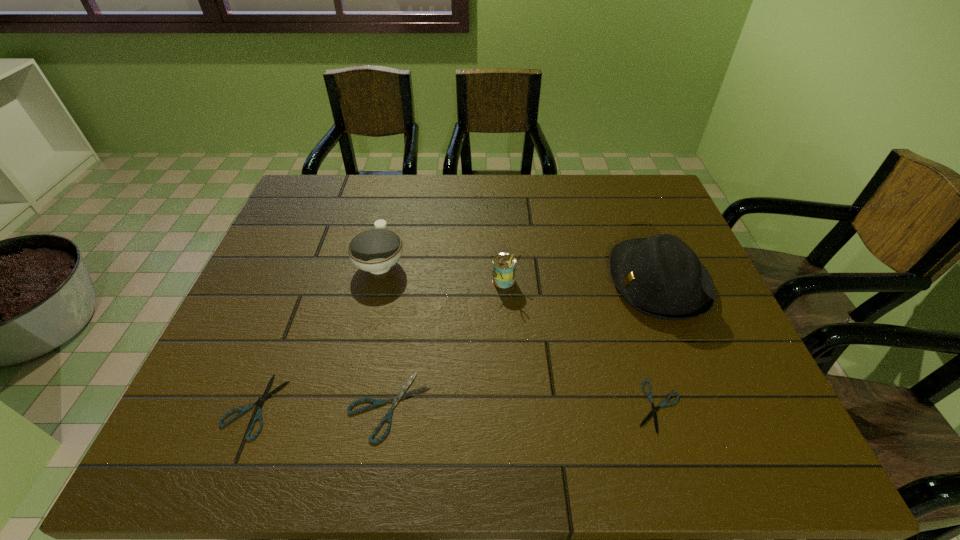
Where is `free space located on the back of the second shears from right to left`? This screenshot has height=540, width=960. free space located on the back of the second shears from right to left is located at coordinates (407, 295).

Locate an element on the screen. vacant area situated 0.160m on the left of the shortest object is located at coordinates point(556,407).

Locate an element on the screen. The width and height of the screenshot is (960, 540). blank area located 0.260m on the side with the handle of the fourth shortest object is located at coordinates (397, 190).

At what (x,y) coordinates should I click in order to perform the action: click on vacant space located 0.310m on the side with the handle of the fourth shortest object. Please return your answer as a coordinate pair (x, y). The width and height of the screenshot is (960, 540). Looking at the image, I should click on (399, 181).

In order to click on free space located 0.060m on the side with the handle of the fourth shortest object in this screenshot , I will do `click(389, 227)`.

The width and height of the screenshot is (960, 540). What are the coordinates of `vacant space located 0.270m on the right of the can` in the screenshot? It's located at (622, 281).

I want to click on free region located 0.070m on the front-facing side of the fedora, so click(583, 281).

Find the location of a particular element. This screenshot has height=540, width=960. vacant space situated on the front-facing side of the fedora is located at coordinates (587, 281).

Locate an element on the screen. vacant space located 0.400m on the front-facing side of the fedora is located at coordinates (458, 281).

Locate an element on the screen. This screenshot has height=540, width=960. object situated at the left edge is located at coordinates (265, 396).